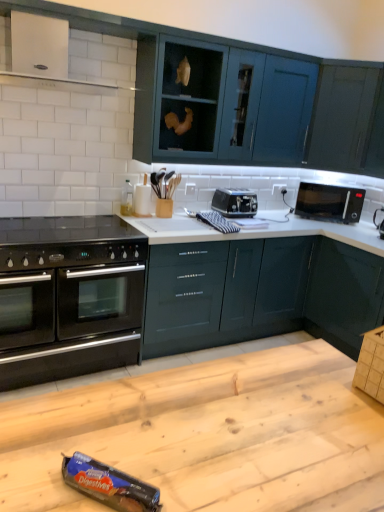
Question: Can you confirm if teal glossy cabinets at upper center, the third cabinetry from the bottom, is bigger than black glossy microwave at upper right?

Choices:
 (A) yes
 (B) no

Answer: (A)

Question: Considering the relative sizes of teal glossy cabinets at upper center, arranged as the 2th cabinetry when viewed from the top, and black glossy microwave at upper right in the image provided, is teal glossy cabinets at upper center, arranged as the 2th cabinetry when viewed from the top, wider than black glossy microwave at upper right?

Choices:
 (A) yes
 (B) no

Answer: (B)

Question: Does teal glossy cabinets at upper center, arranged as the 2th cabinetry when viewed from the top, have a greater height compared to black glossy microwave at upper right?

Choices:
 (A) no
 (B) yes

Answer: (B)

Question: Is teal glossy cabinets at upper center, the third cabinetry from the bottom, thinner than black glossy microwave at upper right?

Choices:
 (A) yes
 (B) no

Answer: (A)

Question: Is teal glossy cabinets at upper center, the third cabinetry from the bottom, not close to black glossy microwave at upper right?

Choices:
 (A) no
 (B) yes

Answer: (A)

Question: Could you tell me if teal glossy cabinets at upper center, the third cabinetry from the bottom, is turned towards black glossy microwave at upper right?

Choices:
 (A) yes
 (B) no

Answer: (A)

Question: From a real-world perspective, is glossy dark green cabinet at lower right, which is the 4th cabinetry in top-to-bottom order, located higher than brown cardboard box at lower right?

Choices:
 (A) no
 (B) yes

Answer: (A)

Question: Is glossy dark green cabinet at lower right, the 1th cabinetry from the bottom, shorter than brown cardboard box at lower right?

Choices:
 (A) yes
 (B) no

Answer: (B)

Question: Is the depth of glossy dark green cabinet at lower right, the 1th cabinetry from the bottom, greater than that of brown cardboard box at lower right?

Choices:
 (A) yes
 (B) no

Answer: (A)

Question: Is glossy dark green cabinet at lower right, the 1th cabinetry from the bottom, outside of brown cardboard box at lower right?

Choices:
 (A) no
 (B) yes

Answer: (B)

Question: Considering the relative sizes of glossy dark green cabinet at lower right, which is the 4th cabinetry in top-to-bottom order, and brown cardboard box at lower right in the image provided, is glossy dark green cabinet at lower right, which is the 4th cabinetry in top-to-bottom order, thinner than brown cardboard box at lower right?

Choices:
 (A) yes
 (B) no

Answer: (B)

Question: Is glossy dark green cabinet at lower right, which is the 4th cabinetry in top-to-bottom order, oriented towards brown cardboard box at lower right?

Choices:
 (A) no
 (B) yes

Answer: (A)

Question: Does black plastic microwave at upper right, positioned as the second appliance in back-to-front order, have a larger size compared to wooden table at center?

Choices:
 (A) yes
 (B) no

Answer: (B)